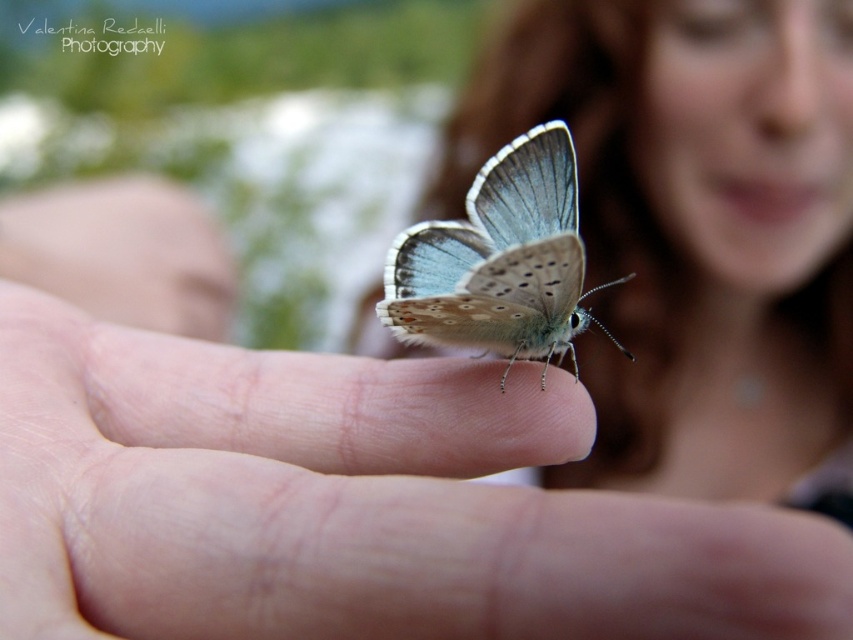
Can you confirm if smooth skin finger at center is taller than smooth skin face at upper center?

No.

Between point (454, 506) and point (579, 374), which one is positioned behind?

The point (579, 374) is behind.

The width and height of the screenshot is (853, 640). What are the coordinates of `smooth skin finger at center` in the screenshot? It's located at (351, 504).

Identify the location of smooth skin finger at center. The height and width of the screenshot is (640, 853). (351, 504).

Is smooth skin face at upper center taller than translucent blue wings at center?

Yes.

Is smooth skin face at upper center shorter than translucent blue wings at center?

Incorrect, smooth skin face at upper center's height does not fall short of translucent blue wings at center's.

What do you see at coordinates (686, 234) in the screenshot?
I see `smooth skin face at upper center` at bounding box center [686, 234].

Find the location of `smooth skin face at upper center`. smooth skin face at upper center is located at coordinates (686, 234).

Is smooth skin finger at center taller than translucent blue wings at center?

No, smooth skin finger at center is not taller than translucent blue wings at center.

From the picture: Is smooth skin finger at center thinner than translucent blue wings at center?

In fact, smooth skin finger at center might be wider than translucent blue wings at center.

Between point (448, 461) and point (450, 237), which one is positioned behind?

The point (450, 237) is behind.

Locate an element on the screen. The width and height of the screenshot is (853, 640). smooth skin finger at center is located at coordinates click(x=351, y=504).